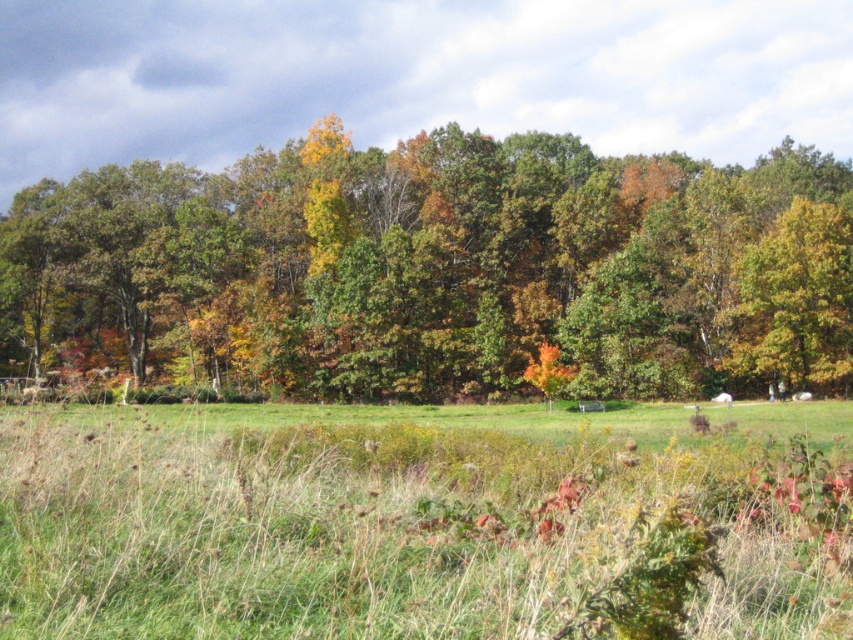
You are standing in the middle of the grassy field and see the green matte tree at upper center and the green grass at center. Which object is positioned to the left when facing the scene?

The green matte tree at upper center is to the left of the green grass at center.